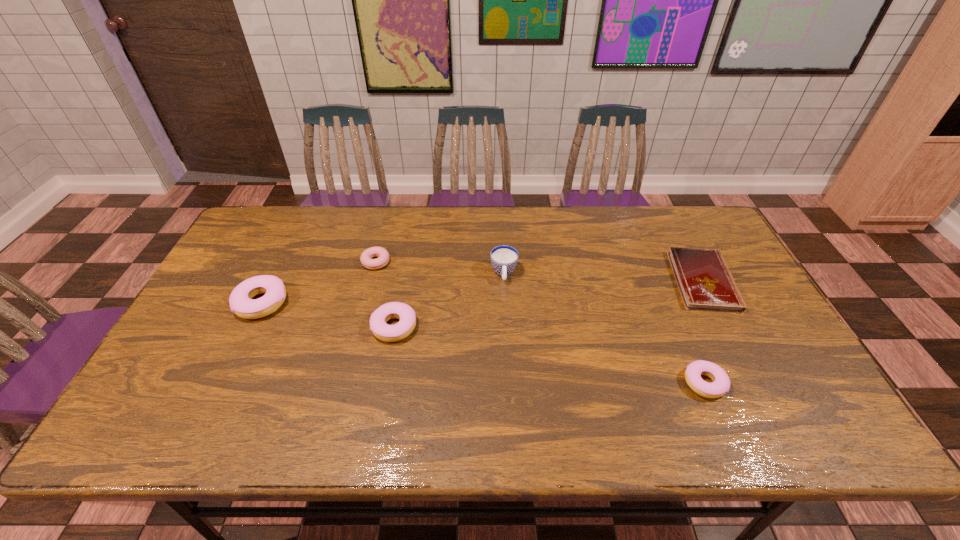
The image size is (960, 540). In order to click on free space between the fourth shortest object and the farthest doughnut in this screenshot , I will do `click(385, 294)`.

At what (x,y) coordinates should I click in order to perform the action: click on vacant area that lies between the shortest object and the farthest doughnut. Please return your answer as a coordinate pair (x, y). Looking at the image, I should click on (540, 272).

Find the location of `vacant area between the nearest object and the cup`. vacant area between the nearest object and the cup is located at coordinates (604, 328).

Locate an element on the screen. The height and width of the screenshot is (540, 960). object identified as the fourth closest to the third shortest doughnut is located at coordinates [x=720, y=386].

What are the coordinates of `the third closest object to the fourth shortest object` in the screenshot? It's located at (241, 303).

Locate an element on the screen. the second closest doughnut relative to the notebook is located at coordinates (390, 333).

Locate an element on the screen. doughnut that is the third closest to the farthest doughnut is located at coordinates (720, 386).

I want to click on free location that satisfies the following two spatial constraints: 1. on the back side of the leftmost object; 2. on the right side of the farthest doughnut, so click(282, 262).

Identify the location of free space that satisfies the following two spatial constraints: 1. on the front side of the fifth shortest object; 2. on the right side of the nearest object. The height and width of the screenshot is (540, 960). (224, 383).

This screenshot has height=540, width=960. In order to click on vacant area in the image that satisfies the following two spatial constraints: 1. on the side of the cup with the handle; 2. on the right side of the rightmost doughnut in this screenshot , I will do `click(510, 383)`.